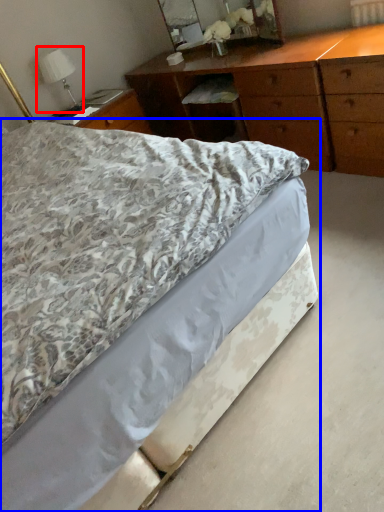
Question: Which object is closer to the camera taking this photo, bedside lamp (highlighted by a red box) or bed (highlighted by a blue box)?

Choices:
 (A) bedside lamp
 (B) bed

Answer: (B)